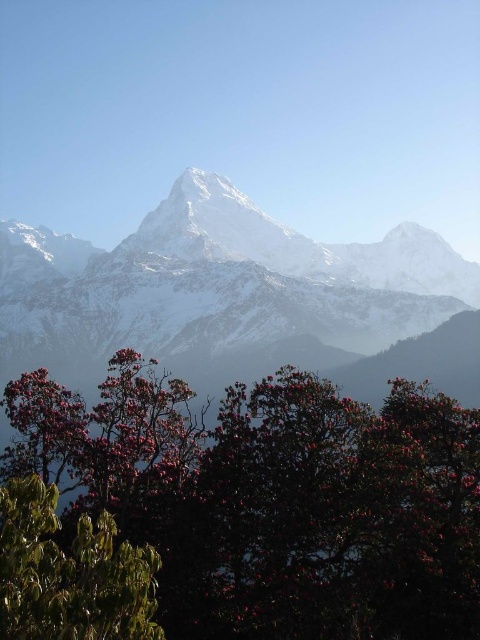
Can you confirm if dark green leafy tree at center is shorter than green glossy leaves at lower left?

In fact, dark green leafy tree at center may be taller than green glossy leaves at lower left.

Which is above, dark green leafy tree at center or green glossy leaves at lower left?

dark green leafy tree at center is above.

Find the location of a particular element. This screenshot has width=480, height=640. dark green leafy tree at center is located at coordinates (273, 499).

The height and width of the screenshot is (640, 480). Find the location of `dark green leafy tree at center`. dark green leafy tree at center is located at coordinates (273, 499).

Is white snow-covered mountain range at center smaller than green glossy leaves at lower left?

No, white snow-covered mountain range at center is not smaller than green glossy leaves at lower left.

Is point (148, 241) closer to viewer compared to point (54, 499)?

That is False.

Who is more distant from viewer, [210,260] or [113,627]?

The point [210,260] is more distant.

What are the coordinates of `white snow-covered mountain range at center` in the screenshot? It's located at (218, 289).

Between dark green leafy tree at center and white snow-covered mountain range at center, which one appears on the left side from the viewer's perspective?

dark green leafy tree at center

Does point (428, 492) come in front of point (291, 241)?

Yes.

I want to click on dark green leafy tree at center, so click(273, 499).